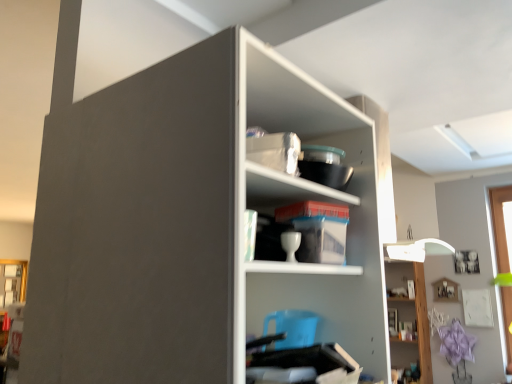
Question: Is matte gold frame at lower left facing away from white matte shelf at center, the 2th shelf when ordered from top to bottom?

Choices:
 (A) yes
 (B) no

Answer: (B)

Question: Can you confirm if matte gold frame at lower left is positioned to the right of white matte shelf at center, positioned as the 1th shelf in front-to-back order?

Choices:
 (A) yes
 (B) no

Answer: (B)

Question: From a real-world perspective, is matte gold frame at lower left on top of white matte shelf at center, which is counted as the 3th shelf, starting from the back?

Choices:
 (A) no
 (B) yes

Answer: (A)

Question: Is matte gold frame at lower left positioned in front of white matte shelf at center, which is counted as the 3th shelf, starting from the back?

Choices:
 (A) yes
 (B) no

Answer: (B)

Question: From a real-world perspective, is matte gold frame at lower left beneath white matte shelf at center, the 2th shelf ordered from the bottom?

Choices:
 (A) no
 (B) yes

Answer: (B)

Question: From a real-world perspective, is white glossy cabinet at upper right above or below matte gold frame at lower left?

Choices:
 (A) below
 (B) above

Answer: (B)

Question: Is white glossy cabinet at upper right wider or thinner than matte gold frame at lower left?

Choices:
 (A) wide
 (B) thin

Answer: (A)

Question: Is white glossy cabinet at upper right inside or outside of matte gold frame at lower left?

Choices:
 (A) outside
 (B) inside

Answer: (A)

Question: From the image's perspective, is white glossy cabinet at upper right above or below matte gold frame at lower left?

Choices:
 (A) above
 (B) below

Answer: (A)

Question: Is white matte shelf at center, which is counted as the 3th shelf, starting from the back, taller or shorter than white glossy cabinet at upper right?

Choices:
 (A) short
 (B) tall

Answer: (B)

Question: Considering their positions, is white matte shelf at center, which is counted as the 3th shelf, starting from the back, located in front of or behind white glossy cabinet at upper right?

Choices:
 (A) behind
 (B) front

Answer: (B)

Question: From the image's perspective, relative to white glossy cabinet at upper right, is white matte shelf at center, the first shelf when ordered from left to right, above or below?

Choices:
 (A) below
 (B) above

Answer: (B)

Question: Is white matte shelf at center, which is counted as the 3th shelf, starting from the back, wider or thinner than white glossy cabinet at upper right?

Choices:
 (A) wide
 (B) thin

Answer: (A)

Question: In the image, is white glossy cabinet at upper right on the left side or the right side of white glossy cup at center, which ranks as the second shelf in back-to-front order?

Choices:
 (A) left
 (B) right

Answer: (B)

Question: From a real-world perspective, relative to white glossy cup at center, which is counted as the 2th shelf, starting from the right, is white glossy cabinet at upper right vertically above or below?

Choices:
 (A) above
 (B) below

Answer: (B)